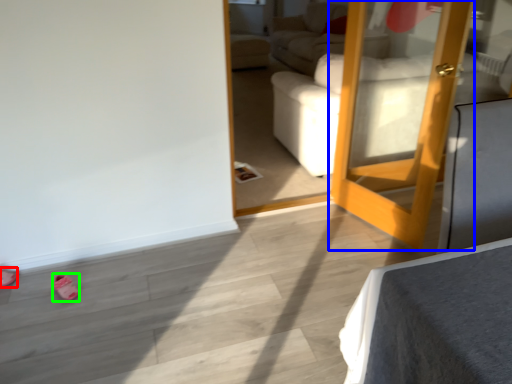
Question: Which is nearer to the shoe (highlighted by a red box)? door (highlighted by a blue box) or shoe (highlighted by a green box).

Choices:
 (A) door
 (B) shoe

Answer: (B)